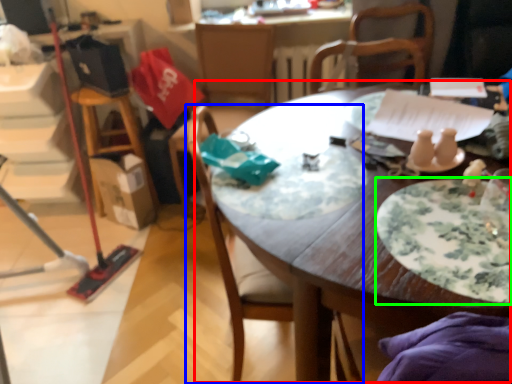
Question: Considering the real-world distances, which object is closest to table (highlighted by a red box)? chair (highlighted by a blue box) or plate (highlighted by a green box).

Choices:
 (A) chair
 (B) plate

Answer: (A)